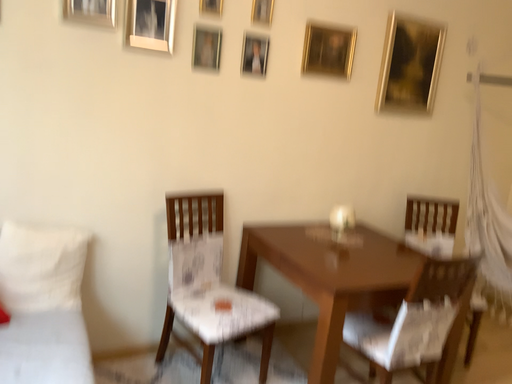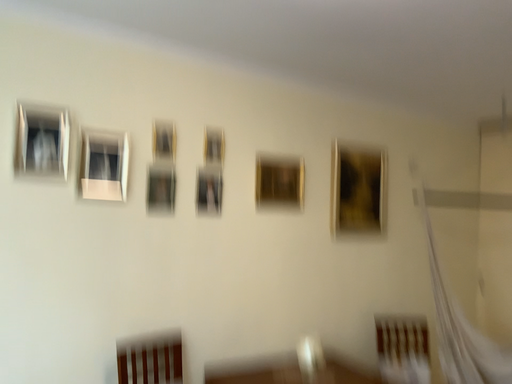
Question: How did the camera likely rotate when shooting the video?

Choices:
 (A) rotated downward
 (B) rotated upward

Answer: (B)